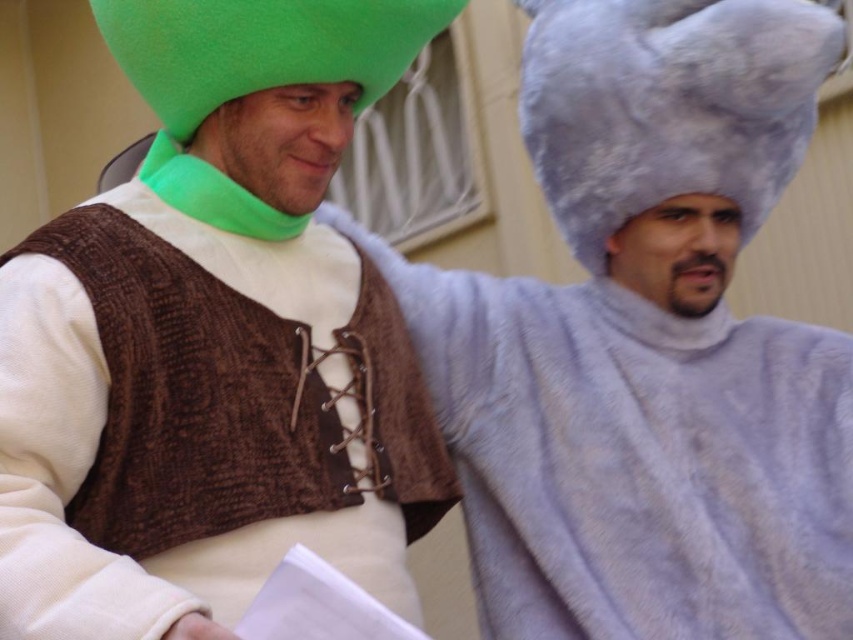
Question: Which point is farther to the camera?

Choices:
 (A) fuzzy gray hat at right
 (B) matte green hat at upper left

Answer: (A)

Question: Among these points, which one is nearest to the camera?

Choices:
 (A) (428, 488)
 (B) (482, 428)

Answer: (A)

Question: Observing the image, what is the correct spatial positioning of matte green hat at upper left in reference to fuzzy gray hat at right?

Choices:
 (A) above
 (B) below

Answer: (A)

Question: Is matte green hat at upper left behind fuzzy gray hat at right?

Choices:
 (A) no
 (B) yes

Answer: (A)

Question: Can you confirm if matte green hat at upper left is positioned below fuzzy gray hat at right?

Choices:
 (A) yes
 (B) no

Answer: (B)